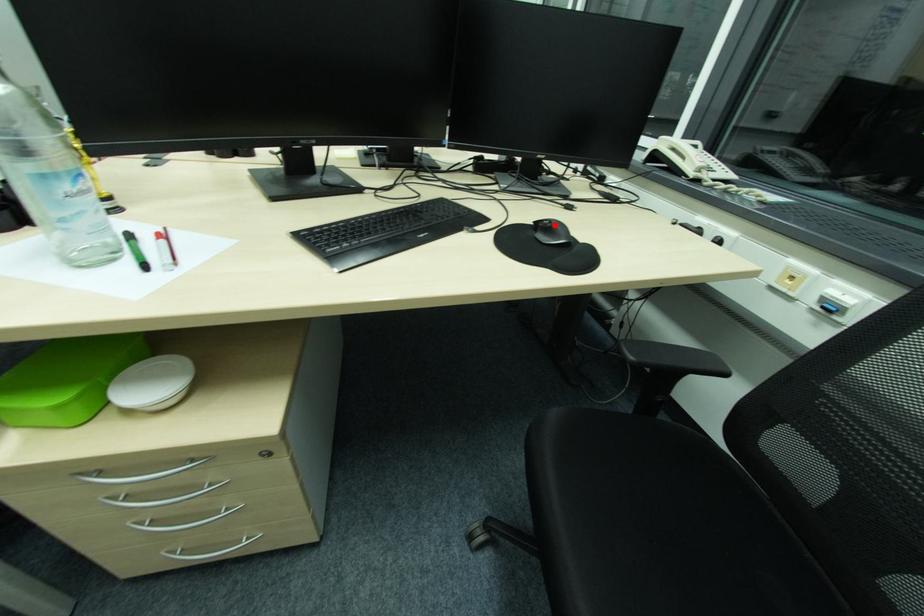
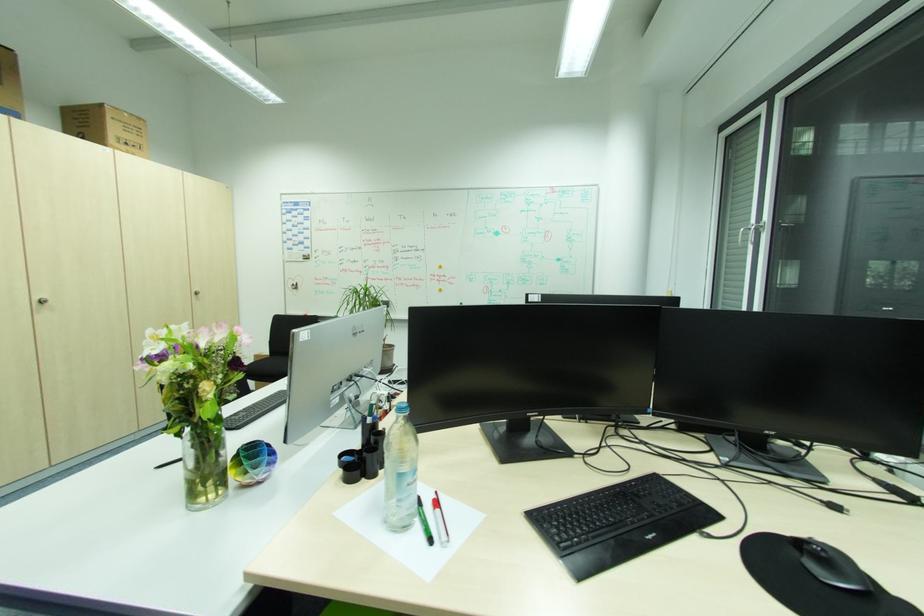
Question: I am providing you with two images of the same scene from different viewpoints. Image1 has a red point marked. In image2, the corresponding 3D location appears at what relative position? Reply with the corresponding letter.

Choices:
 (A) Closer
 (B) Farther

Answer: (A)